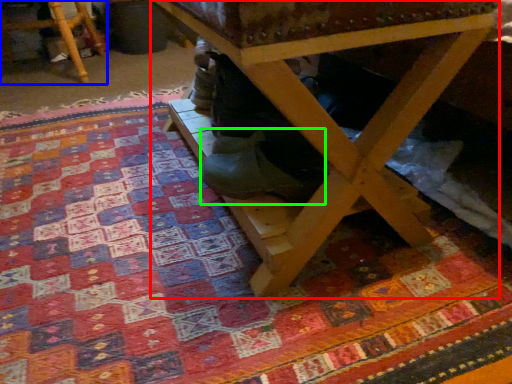
Question: Which is farther away from table (highlighted by a red box)? furniture (highlighted by a blue box) or shoe (highlighted by a green box)?

Choices:
 (A) furniture
 (B) shoe

Answer: (A)